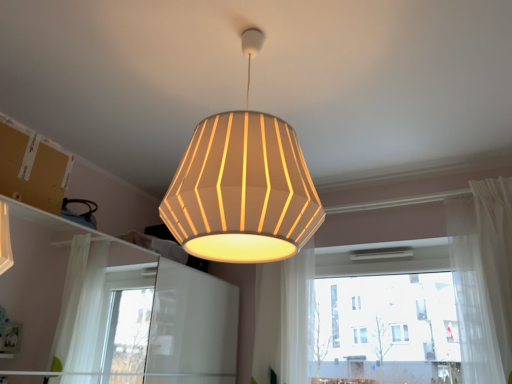
Question: From a real-world perspective, is white glass window at center on top of white sheer curtain at right, the second curtain viewed from the left?

Choices:
 (A) yes
 (B) no

Answer: (B)

Question: Is white glass window at center not within white sheer curtain at right, the second curtain viewed from the left?

Choices:
 (A) yes
 (B) no

Answer: (A)

Question: Is white glass window at center bigger than white sheer curtain at right, the second curtain viewed from the left?

Choices:
 (A) no
 (B) yes

Answer: (B)

Question: From the image's perspective, would you say white glass window at center is shown under white sheer curtain at right, the second curtain viewed from the left?

Choices:
 (A) yes
 (B) no

Answer: (A)

Question: Does white glass window at center lie behind white sheer curtain at right, the second curtain viewed from the left?

Choices:
 (A) no
 (B) yes

Answer: (B)

Question: Can you confirm if white glass window at center is taller than white sheer curtain at right, the second curtain viewed from the left?

Choices:
 (A) yes
 (B) no

Answer: (B)

Question: Could you tell me if white glass window at center is turned towards brown cardboard at upper left?

Choices:
 (A) no
 (B) yes

Answer: (B)

Question: From a real-world perspective, is white glass window at center over brown cardboard at upper left?

Choices:
 (A) yes
 (B) no

Answer: (B)

Question: Does white glass window at center come behind brown cardboard at upper left?

Choices:
 (A) yes
 (B) no

Answer: (A)

Question: Is brown cardboard at upper left inside white glass window at center?

Choices:
 (A) no
 (B) yes

Answer: (A)

Question: Are white glass window at center and brown cardboard at upper left making contact?

Choices:
 (A) no
 (B) yes

Answer: (A)

Question: Is white glass window at center positioned in front of brown cardboard at upper left?

Choices:
 (A) no
 (B) yes

Answer: (A)

Question: Is white sheer curtain at center, which is counted as the second curtain, starting from the right, in front of brown cardboard at upper left?

Choices:
 (A) yes
 (B) no

Answer: (B)